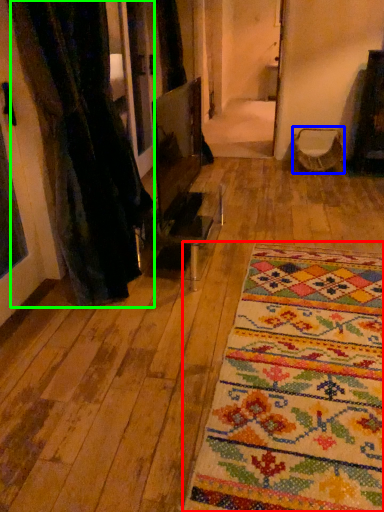
Question: Which object is positioned farthest from mat (highlighted by a red box)? Select from armchair (highlighted by a blue box) and curtain (highlighted by a green box).

Choices:
 (A) armchair
 (B) curtain

Answer: (A)